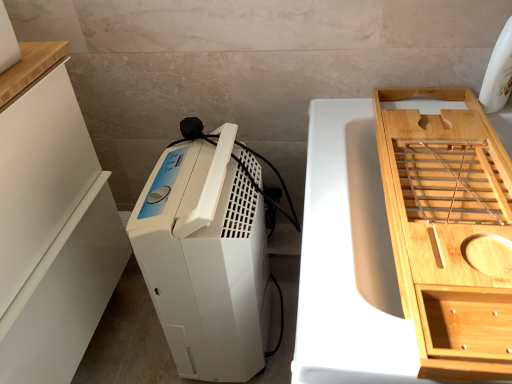
Question: Is white matte cabinet at left, which is counted as the second cabinetry, starting from the right, positioned far away from light wood/texture bamboo tray at right, the first cabinetry from the right?

Choices:
 (A) no
 (B) yes

Answer: (A)

Question: Is white matte cabinet at left, which is counted as the second cabinetry, starting from the right, aimed at light wood/texture bamboo tray at right, the first cabinetry from the right?

Choices:
 (A) no
 (B) yes

Answer: (B)

Question: Considering the relative positions of white matte cabinet at left, which is counted as the second cabinetry, starting from the right, and light wood/texture bamboo tray at right, which ranks as the 2th cabinetry in left-to-right order, in the image provided, is white matte cabinet at left, which is counted as the second cabinetry, starting from the right, in front of light wood/texture bamboo tray at right, which ranks as the 2th cabinetry in left-to-right order,?

Choices:
 (A) no
 (B) yes

Answer: (A)

Question: Does white matte cabinet at left, acting as the 1th cabinetry starting from the left, have a smaller size compared to light wood/texture bamboo tray at right, which ranks as the 2th cabinetry in left-to-right order?

Choices:
 (A) yes
 (B) no

Answer: (B)

Question: Considering the relative sizes of white matte cabinet at left, which is counted as the second cabinetry, starting from the right, and light wood/texture bamboo tray at right, which ranks as the 2th cabinetry in left-to-right order, in the image provided, is white matte cabinet at left, which is counted as the second cabinetry, starting from the right, thinner than light wood/texture bamboo tray at right, which ranks as the 2th cabinetry in left-to-right order,?

Choices:
 (A) no
 (B) yes

Answer: (A)

Question: In the image, is white matte cabinet at left, which is counted as the second cabinetry, starting from the right, on the left side or the right side of light wood/texture bamboo tray at right, the first cabinetry from the right?

Choices:
 (A) left
 (B) right

Answer: (A)

Question: From the image's perspective, is white matte cabinet at left, acting as the 1th cabinetry starting from the left, above or below light wood/texture bamboo tray at right, which ranks as the 2th cabinetry in left-to-right order?

Choices:
 (A) below
 (B) above

Answer: (A)

Question: From a real-world perspective, is white matte cabinet at left, which is counted as the second cabinetry, starting from the right, above or below light wood/texture bamboo tray at right, which ranks as the 2th cabinetry in left-to-right order?

Choices:
 (A) above
 (B) below

Answer: (B)

Question: Is white matte cabinet at left, which is counted as the second cabinetry, starting from the right, taller or shorter than light wood/texture bamboo tray at right, which ranks as the 2th cabinetry in left-to-right order?

Choices:
 (A) tall
 (B) short

Answer: (A)

Question: From a real-world perspective, is white matte cabinet at left, which is counted as the second cabinetry, starting from the right, physically located above or below white plastic dehumidifier at center?

Choices:
 (A) above
 (B) below

Answer: (A)

Question: Is point (54, 269) positioned closer to the camera than point (148, 274)?

Choices:
 (A) closer
 (B) farther

Answer: (B)

Question: Would you say white matte cabinet at left, acting as the 1th cabinetry starting from the left, is inside or outside white plastic dehumidifier at center?

Choices:
 (A) outside
 (B) inside

Answer: (A)

Question: From the image's perspective, is white matte cabinet at left, acting as the 1th cabinetry starting from the left, located above or below white plastic dehumidifier at center?

Choices:
 (A) above
 (B) below

Answer: (A)

Question: Is point (423, 256) positioned closer to the camera than point (186, 345)?

Choices:
 (A) farther
 (B) closer

Answer: (B)

Question: From a real-world perspective, is light wood/texture bamboo tray at right, the first cabinetry from the right, above or below white plastic dehumidifier at center?

Choices:
 (A) below
 (B) above

Answer: (B)